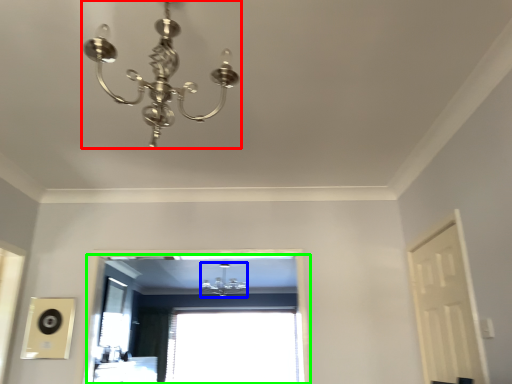
Question: Which is nearer to the lamp (highlighted by a red box)? lamp (highlighted by a blue box) or window (highlighted by a green box).

Choices:
 (A) lamp
 (B) window

Answer: (A)